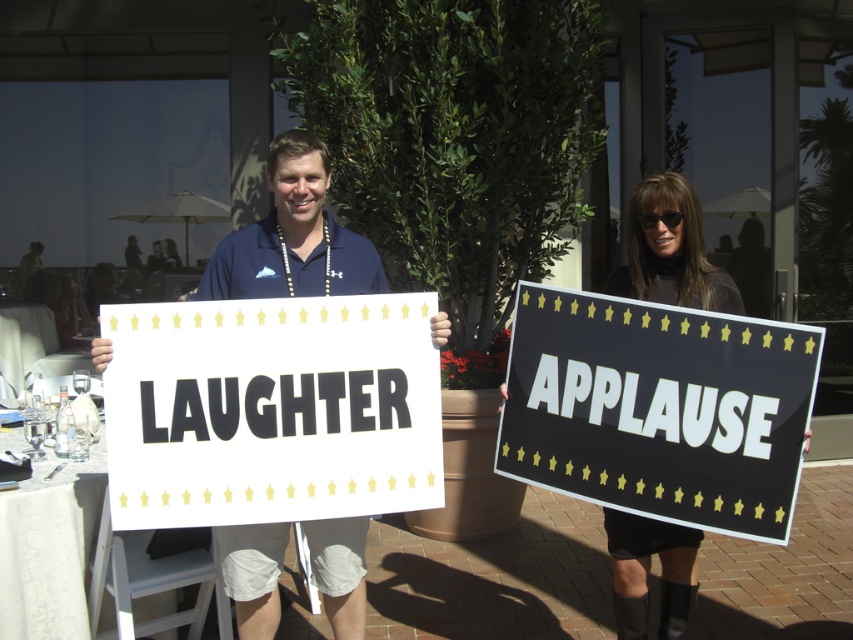
Question: Is white paper sign at center bigger than black matte sign at right?

Choices:
 (A) no
 (B) yes

Answer: (A)

Question: Estimate the real-world distances between objects in this image. Which object is closer to the black leather boots at lower right?

Choices:
 (A) black matte sign at right
 (B) blue fabric shirt at center

Answer: (A)

Question: Can you confirm if white paper sign at center is thinner than blue fabric shirt at center?

Choices:
 (A) no
 (B) yes

Answer: (A)

Question: Among these objects, which one is nearest to the camera?

Choices:
 (A) black matte sign at right
 (B) black leather boots at lower right

Answer: (A)

Question: Which of these objects is positioned closest to the blue fabric shirt at center?

Choices:
 (A) white paper sign at center
 (B) black matte sign at right

Answer: (A)

Question: Does white paper sign at center appear over blue fabric shirt at center?

Choices:
 (A) no
 (B) yes

Answer: (A)